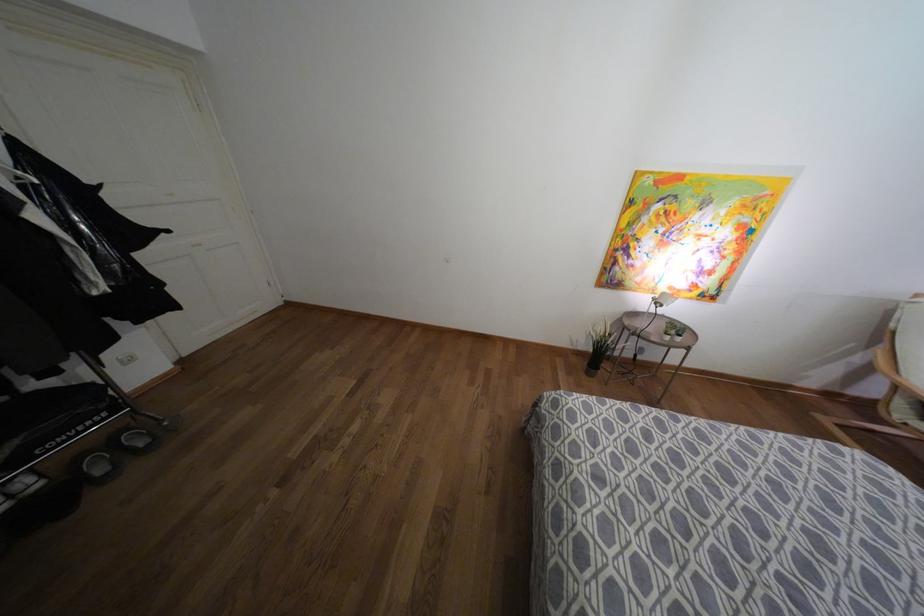
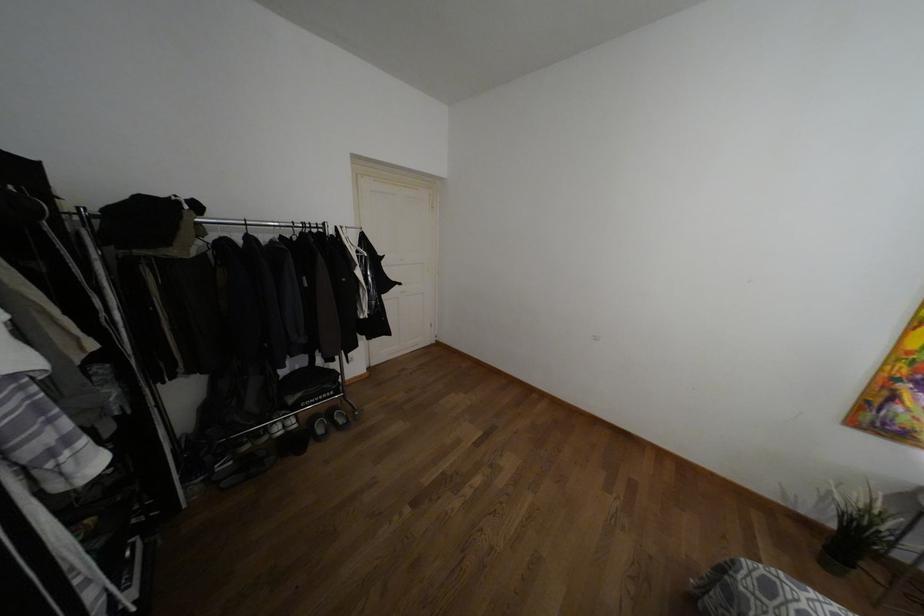
The point at (100, 469) is marked in the first image. Where is the corresponding point in the second image?

(320, 430)